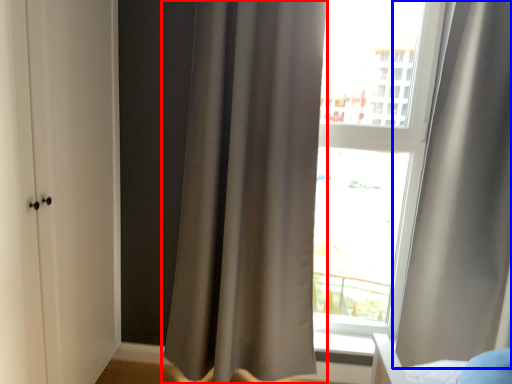
Question: Which object is further to the camera taking this photo, curtain (highlighted by a red box) or curtain (highlighted by a blue box)?

Choices:
 (A) curtain
 (B) curtain

Answer: (A)